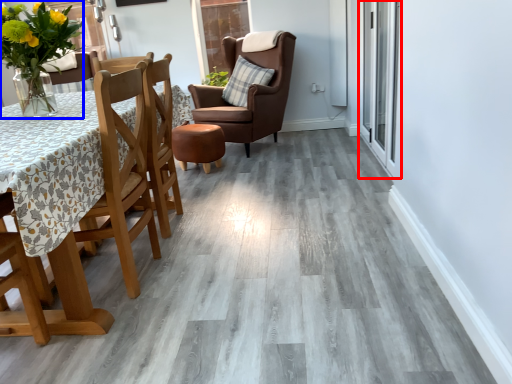
Question: Which point is closer to the camera, glass door (highlighted by a red box) or floral arrangement (highlighted by a blue box)?

Choices:
 (A) glass door
 (B) floral arrangement

Answer: (B)